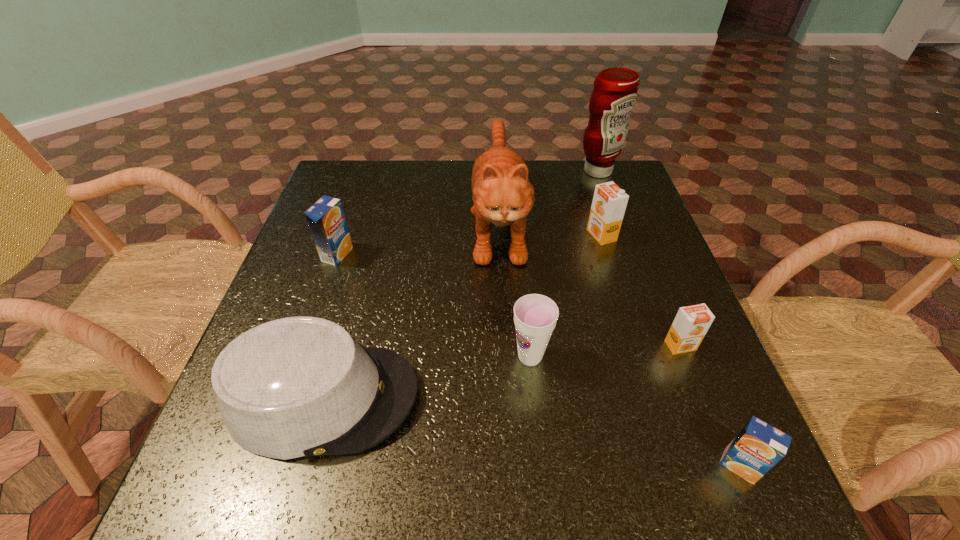
The image size is (960, 540). What are the coordinates of `the right orange orange juice` in the screenshot? It's located at (691, 323).

The image size is (960, 540). I want to click on the smaller orange orange juice, so click(x=691, y=323).

Locate an element on the screen. free space located 0.260m on the front of the condiment is located at coordinates (622, 239).

What are the coordinates of `vacant space situated 0.200m on the face of the orange cat` in the screenshot? It's located at 505,361.

At what (x,y) coordinates should I click in order to perform the action: click on vacant space located on the right of the leftmost orange juice. Please return your answer as a coordinate pair (x, y). The image size is (960, 540). Looking at the image, I should click on (380, 254).

Find the location of a particular element. The image size is (960, 540). free space located on the front of the farther orange orange juice is located at coordinates (632, 336).

At what (x,y) coordinates should I click in order to perform the action: click on vacant area located on the left of the purple cup. Please return your answer as a coordinate pair (x, y). This screenshot has height=540, width=960. Looking at the image, I should click on (433, 357).

Where is `free point located on the front-facing side of the hat`? Image resolution: width=960 pixels, height=540 pixels. free point located on the front-facing side of the hat is located at coordinates (612, 397).

Where is `vacant region located 0.340m on the left of the smaller blue orange_juice`? vacant region located 0.340m on the left of the smaller blue orange_juice is located at coordinates [509, 465].

Locate an element on the screen. vacant space situated 0.240m on the left of the smaller orange orange juice is located at coordinates (545, 346).